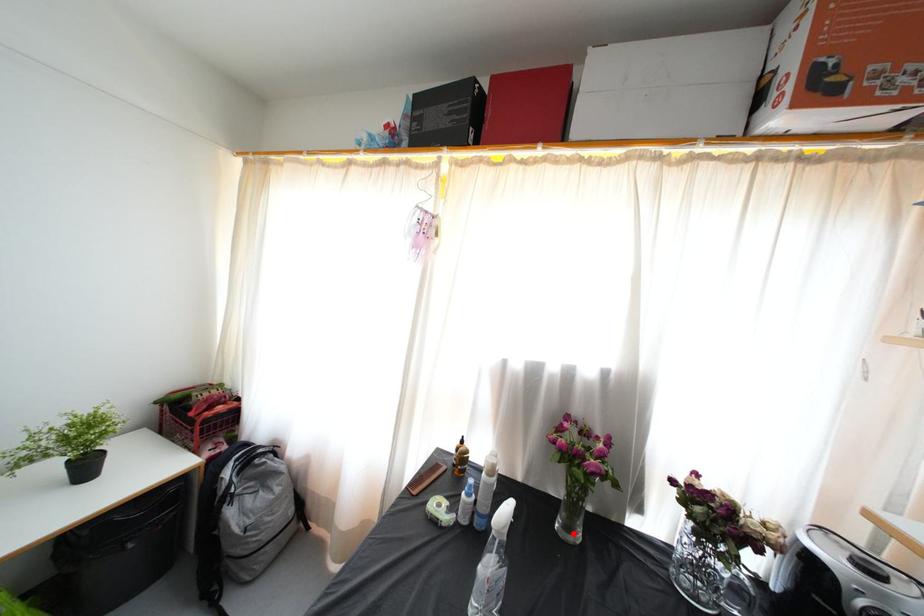
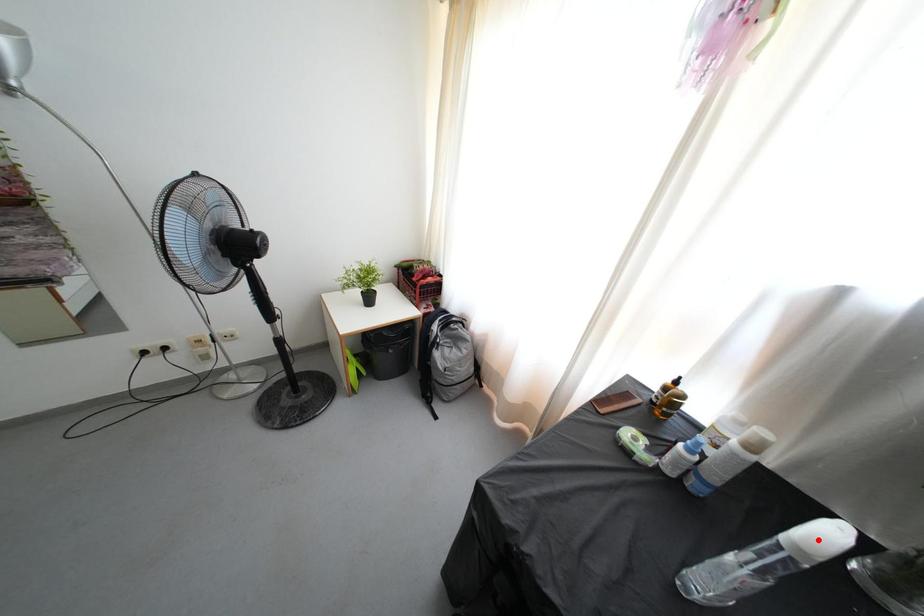
I am providing you with two images of the same scene from different viewpoints. A red point is marked on the first image and another point is marked on the second image. Does the point marked in image1 correspond to the same location as the one in image2?

No